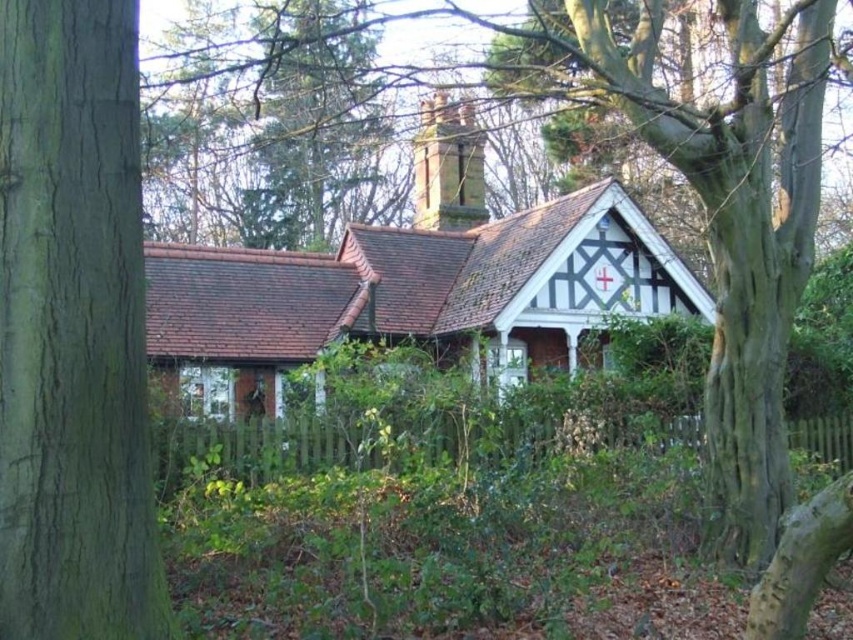
Can you confirm if green rough bark tree at left is positioned to the right of white painted wood cottage at center?

Incorrect, green rough bark tree at left is not on the right side of white painted wood cottage at center.

Can you confirm if green rough bark tree at left is shorter than white painted wood cottage at center?

Indeed, green rough bark tree at left has a lesser height compared to white painted wood cottage at center.

Is point (83, 490) closer to camera compared to point (416, 323)?

Yes, point (83, 490) is in front of point (416, 323).

This screenshot has height=640, width=853. Find the location of `green rough bark tree at left`. green rough bark tree at left is located at coordinates (73, 330).